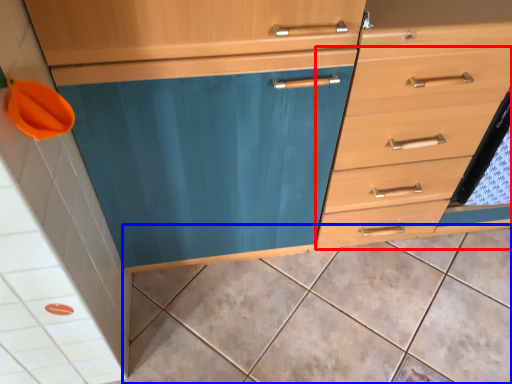
Question: Which point is closer to the camera, drawer (highlighted by a red box) or ceramic tile (highlighted by a blue box)?

Choices:
 (A) drawer
 (B) ceramic tile

Answer: (A)